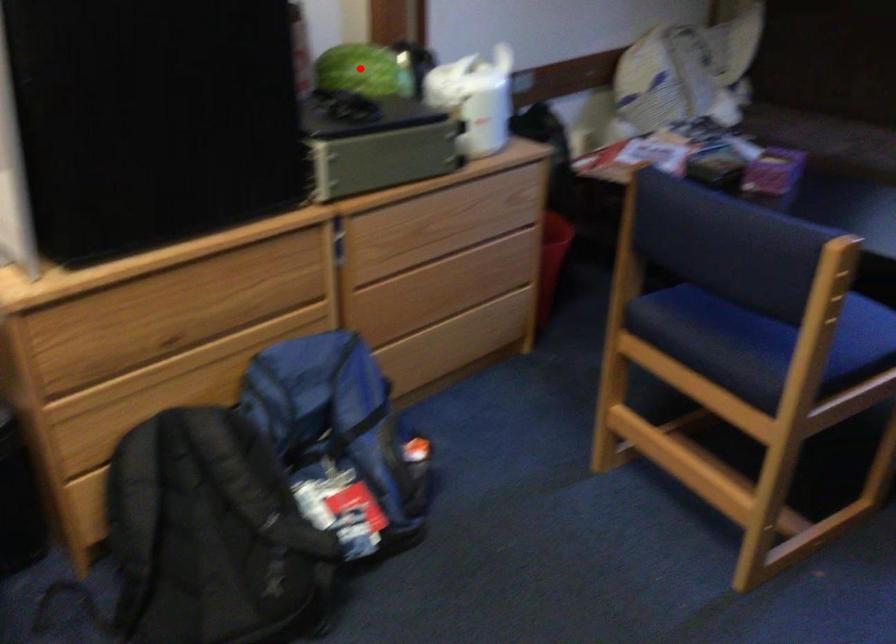
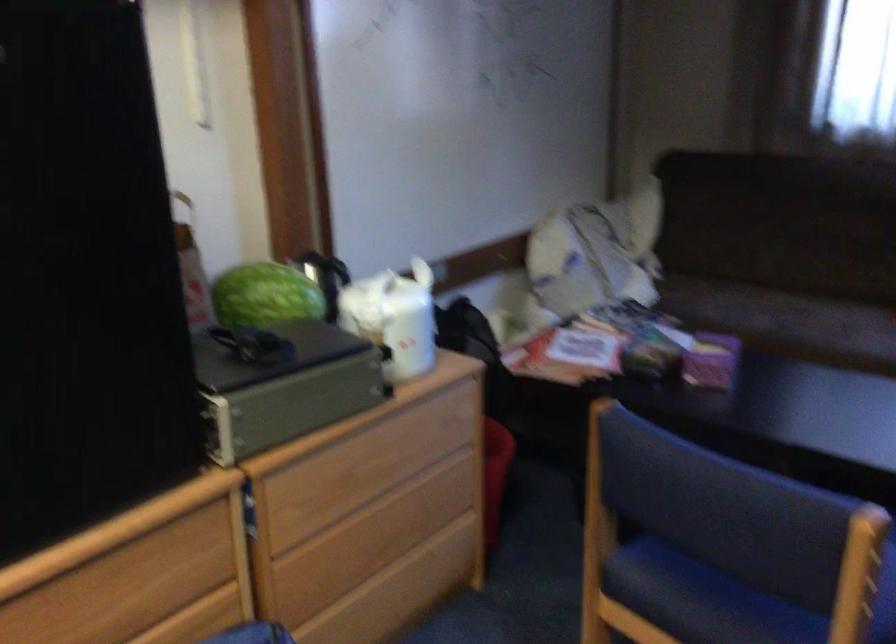
Locate, in the second image, the point that corresponds to the highlighted location in the first image.

(264, 295)